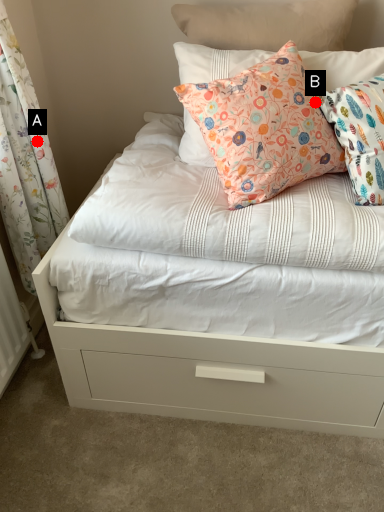
Question: Two points are circled on the image, labeled by A and B beside each circle. Which point is closer to the camera?

Choices:
 (A) A is closer
 (B) B is closer

Answer: (B)